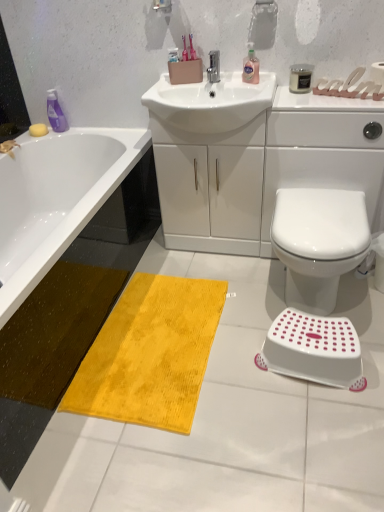
Question: In which direction should I rotate to look at pink translucent liquid at upper center, the 2th cleaning product positioned from the left?

Choices:
 (A) right
 (B) left

Answer: (A)

Question: Is yellow plush mat at lower left at the right side of white glossy sink at center?

Choices:
 (A) no
 (B) yes

Answer: (A)

Question: Can white glossy sink at center be found inside yellow plush mat at lower left?

Choices:
 (A) yes
 (B) no

Answer: (B)

Question: Is yellow plush mat at lower left positioned far away from white glossy sink at center?

Choices:
 (A) yes
 (B) no

Answer: (B)

Question: From the image's perspective, does yellow plush mat at lower left appear higher than white glossy sink at center?

Choices:
 (A) no
 (B) yes

Answer: (A)

Question: Considering the relative sizes of yellow plush mat at lower left and white glossy sink at center in the image provided, is yellow plush mat at lower left taller than white glossy sink at center?

Choices:
 (A) yes
 (B) no

Answer: (A)

Question: Could you tell me if yellow plush mat at lower left is turned towards white glossy sink at center?

Choices:
 (A) no
 (B) yes

Answer: (A)

Question: From a real-world perspective, is silver metallic faucet at center over purple plastic bottle at upper left, which ranks as the first cleaning product in back-to-front order?

Choices:
 (A) no
 (B) yes

Answer: (B)

Question: Are silver metallic faucet at center and purple plastic bottle at upper left, which ranks as the first cleaning product in back-to-front order, making contact?

Choices:
 (A) no
 (B) yes

Answer: (A)

Question: From the image's perspective, would you say silver metallic faucet at center is positioned over purple plastic bottle at upper left, the second cleaning product viewed from the front?

Choices:
 (A) no
 (B) yes

Answer: (B)

Question: Can you confirm if silver metallic faucet at center is smaller than purple plastic bottle at upper left, the first cleaning product viewed from the left?

Choices:
 (A) yes
 (B) no

Answer: (A)

Question: Is silver metallic faucet at center bigger than purple plastic bottle at upper left, the first cleaning product viewed from the left?

Choices:
 (A) no
 (B) yes

Answer: (A)

Question: Considering the relative sizes of silver metallic faucet at center and purple plastic bottle at upper left, the second cleaning product viewed from the front, in the image provided, is silver metallic faucet at center thinner than purple plastic bottle at upper left, the second cleaning product viewed from the front,?

Choices:
 (A) no
 (B) yes

Answer: (A)

Question: From the image's perspective, does white glossy toilet at lower right appear lower than silver metallic faucet at center?

Choices:
 (A) yes
 (B) no

Answer: (A)